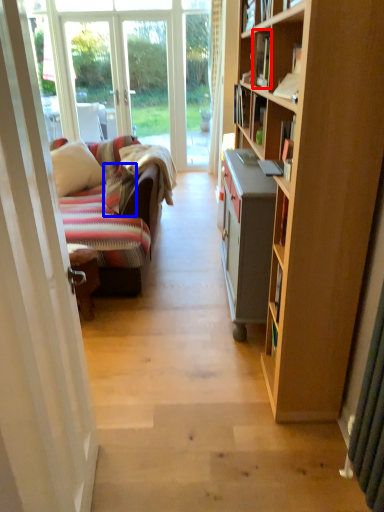
Question: Among these objects, which one is nearest to the camera, book (highlighted by a red box) or pillow (highlighted by a blue box)?

Choices:
 (A) book
 (B) pillow

Answer: (A)